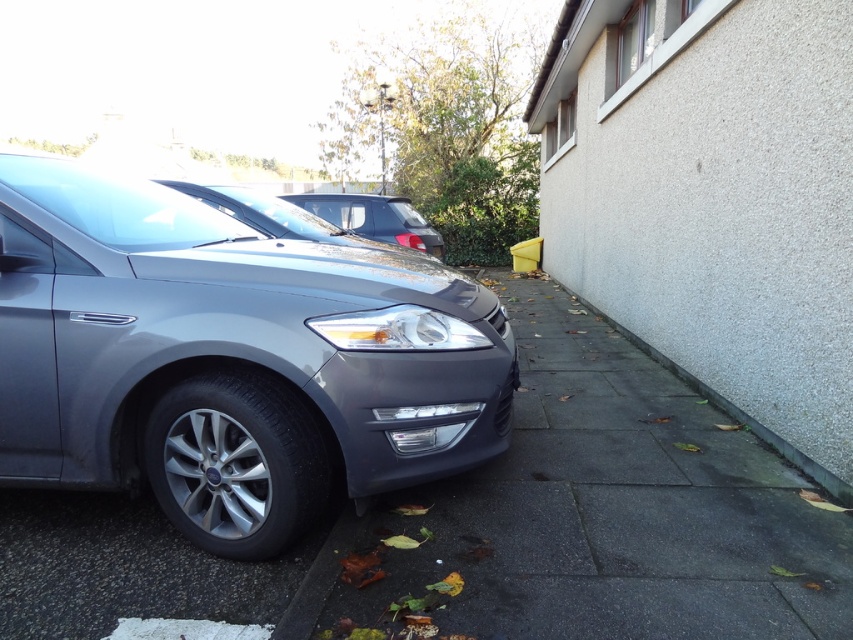
You are driving a car and want to park it on the gray concrete pavement at center. However, there is a gray concrete curb at lower right in the way. Can you drive over the curb to reach the pavement?

The gray concrete pavement at center is in front of the gray concrete curb at lower right, meaning the curb is between you and the pavement. To reach the pavement, you would need to drive around the curb rather than over it since curbs are typically elevated and not meant to be driven over.

You are standing at the edge of the gray concrete pavement at center. You want to walk to the gray car parked on the driveway. Which direction should you walk to reach the gray car parked on the driveway?

Since the gray concrete pavement at center is located at point (x=595, y=515), you should walk towards the direction where the gray car is parked on the driveway to reach it.